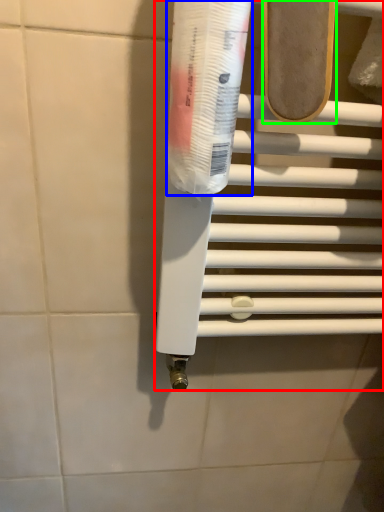
Question: Which object is the closest to the towel bar (highlighted by a red box)? Choose among these: toothpaste (highlighted by a blue box) or footwear (highlighted by a green box).

Choices:
 (A) toothpaste
 (B) footwear

Answer: (A)